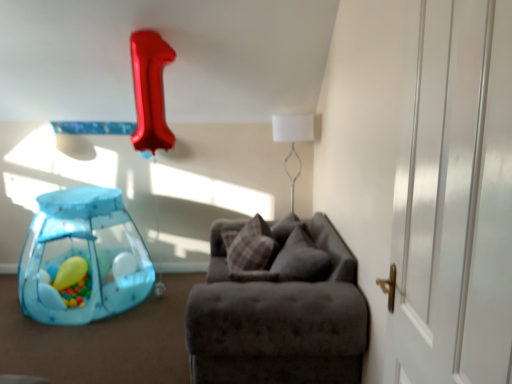
Question: Can you confirm if translucent yellow balloon at lower left is smaller than suede-like gray couch at center?

Choices:
 (A) yes
 (B) no

Answer: (A)

Question: Considering the relative positions of translucent yellow balloon at lower left and suede-like gray couch at center in the image provided, is translucent yellow balloon at lower left behind suede-like gray couch at center?

Choices:
 (A) no
 (B) yes

Answer: (B)

Question: Is translucent yellow balloon at lower left at the left side of suede-like gray couch at center?

Choices:
 (A) no
 (B) yes

Answer: (B)

Question: Is translucent yellow balloon at lower left positioned far away from suede-like gray couch at center?

Choices:
 (A) yes
 (B) no

Answer: (A)

Question: Is translucent yellow balloon at lower left positioned with its back to suede-like gray couch at center?

Choices:
 (A) no
 (B) yes

Answer: (A)

Question: Can you confirm if translucent yellow balloon at lower left is wider than suede-like gray couch at center?

Choices:
 (A) no
 (B) yes

Answer: (A)

Question: Is velvet gray pillow at center, which is the first pillow in right-to-left order, at the back of translucent yellow balloon at lower left?

Choices:
 (A) no
 (B) yes

Answer: (A)

Question: Considering the relative sizes of translucent yellow balloon at lower left and velvet gray pillow at center, which is the first pillow in right-to-left order, in the image provided, is translucent yellow balloon at lower left shorter than velvet gray pillow at center, which is the first pillow in right-to-left order,?

Choices:
 (A) yes
 (B) no

Answer: (A)

Question: Does translucent yellow balloon at lower left turn towards velvet gray pillow at center, arranged as the second pillow when viewed from the left?

Choices:
 (A) no
 (B) yes

Answer: (A)

Question: Can you confirm if translucent yellow balloon at lower left is positioned to the right of velvet gray pillow at center, arranged as the second pillow when viewed from the left?

Choices:
 (A) yes
 (B) no

Answer: (B)

Question: Is translucent yellow balloon at lower left with velvet gray pillow at center, which is the first pillow in right-to-left order?

Choices:
 (A) no
 (B) yes

Answer: (A)

Question: Is translucent yellow balloon at lower left outside velvet gray pillow at center, which is the first pillow in right-to-left order?

Choices:
 (A) yes
 (B) no

Answer: (A)

Question: Does white fabric lampshade at upper center contain transparent plastic playpen at lower left?

Choices:
 (A) no
 (B) yes

Answer: (A)